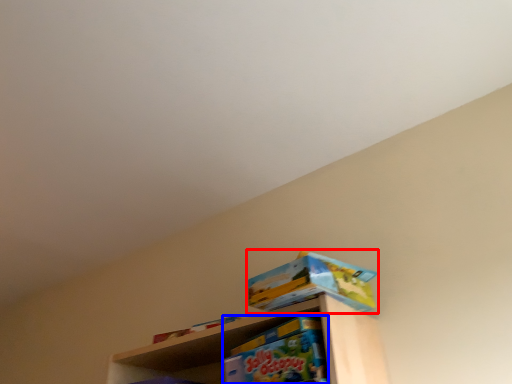
Question: Which of the following is the farthest to the observer, toy (highlighted by a red box) or toy (highlighted by a blue box)?

Choices:
 (A) toy
 (B) toy

Answer: (A)